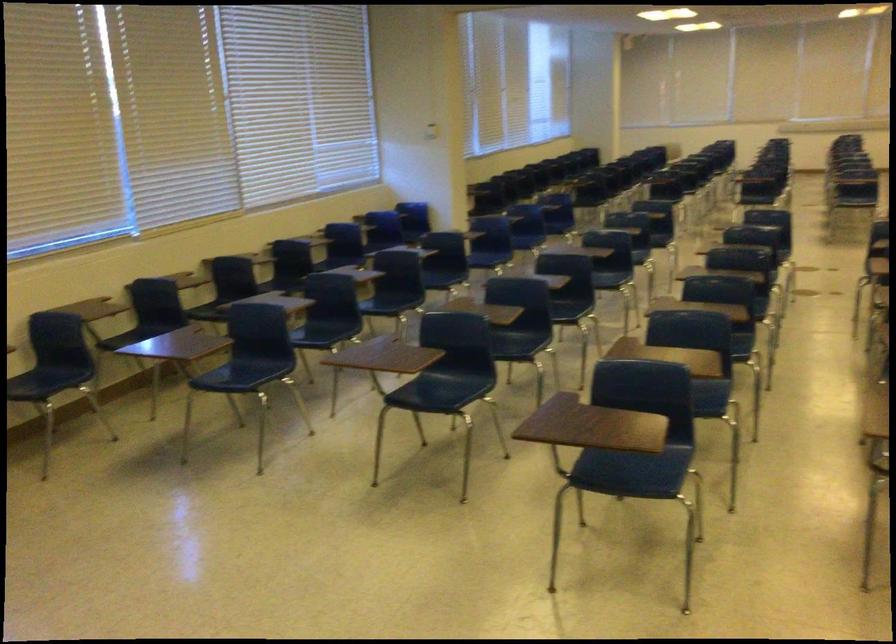
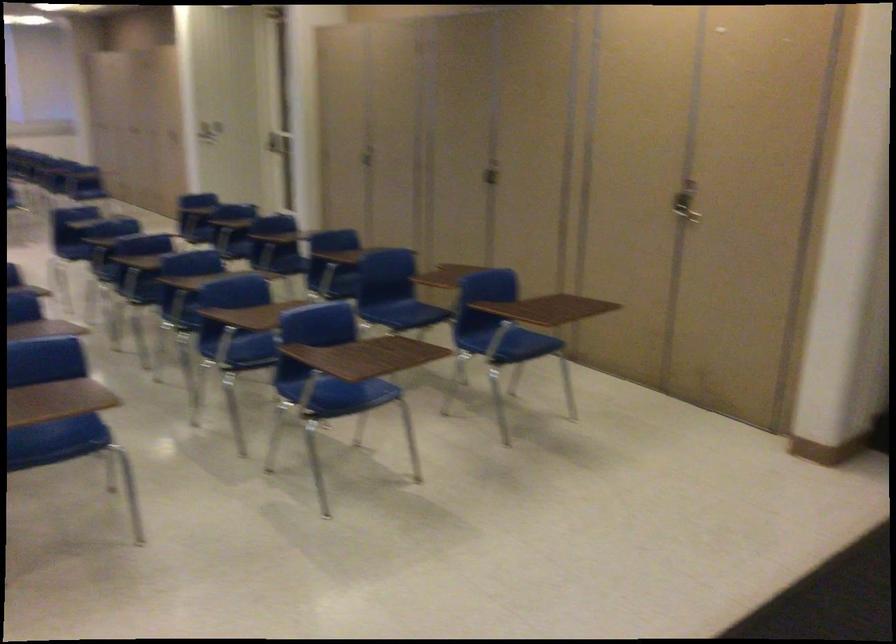
Question: Based on the continuous images, in which direction is the camera rotating? Reply with the corresponding letter.

Choices:
 (A) Left
 (B) Right
 (C) Up
 (D) Down

Answer: (B)